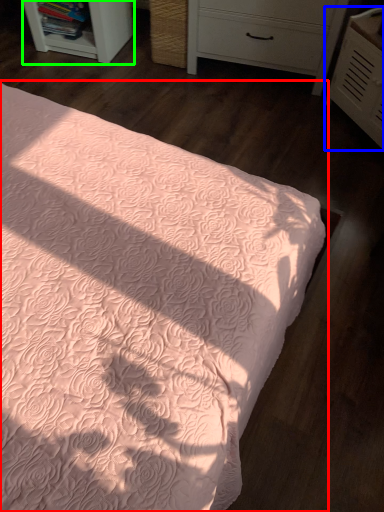
Question: Which is nearer to the bed (highlighted by a red box)? chest of drawers (highlighted by a blue box) or shelf (highlighted by a green box).

Choices:
 (A) chest of drawers
 (B) shelf

Answer: (A)